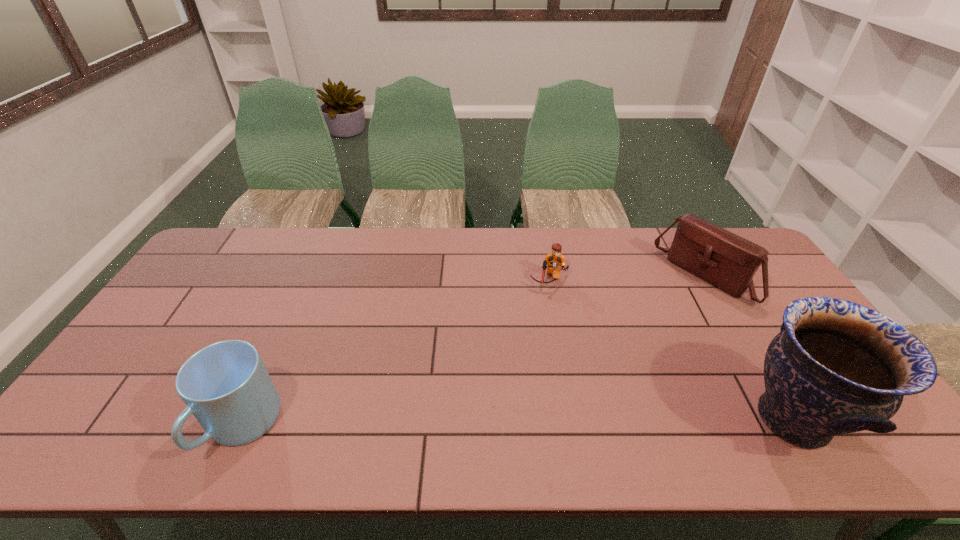
I want to click on object present at the far right corner, so click(729, 262).

The width and height of the screenshot is (960, 540). I want to click on object that is at the near right corner, so click(x=836, y=367).

Where is `vacant area at the far edge`? This screenshot has height=540, width=960. vacant area at the far edge is located at coordinates (419, 231).

Where is `free space at the near edge`? The image size is (960, 540). free space at the near edge is located at coordinates (365, 420).

Find the location of `free space at the left edge`. free space at the left edge is located at coordinates point(135,353).

You are a GUI agent. You are given a task and a screenshot of the screen. Output one action in this format:
    pyautogui.click(x=<x>, y=<y>)
    Task: Click on the vacant area that lies between the Lego and the pottery
    Image resolution: width=960 pixels, height=540 pixels.
    Given the screenshot: What is the action you would take?
    click(671, 350)

Locate an element on the screen. This screenshot has width=960, height=540. vacant region between the pottery and the shortest object is located at coordinates (671, 350).

Identify the location of free point between the second object from left to right and the mug. (396, 353).

You are a GUI agent. You are given a task and a screenshot of the screen. Output one action in this format:
    pyautogui.click(x=<x>, y=<y>)
    Task: Click on the free spot between the mug and the pottery
    This screenshot has height=540, width=960.
    Given the screenshot: What is the action you would take?
    pyautogui.click(x=517, y=423)

This screenshot has width=960, height=540. Find the location of `free spot between the shoulder bag and the mug`. free spot between the shoulder bag and the mug is located at coordinates (473, 352).